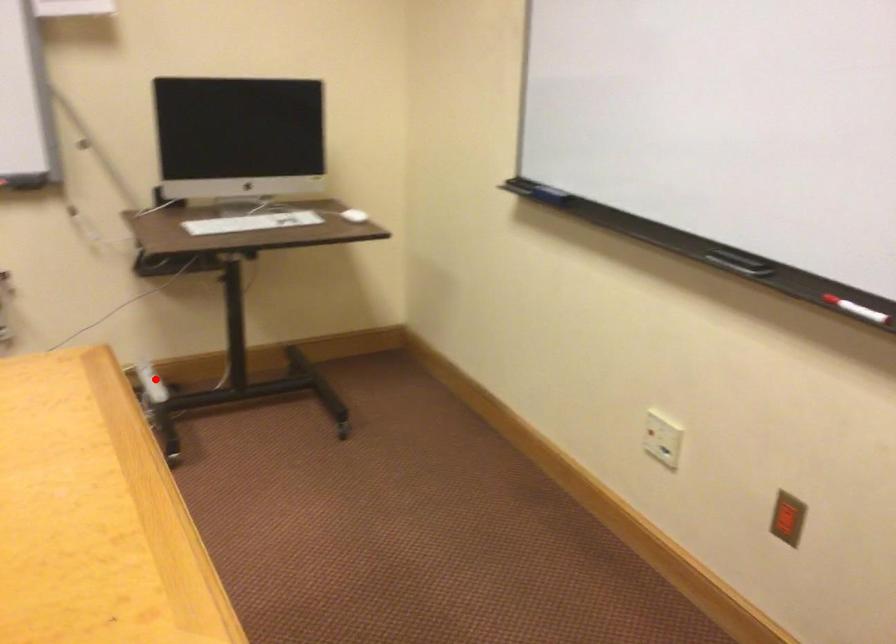
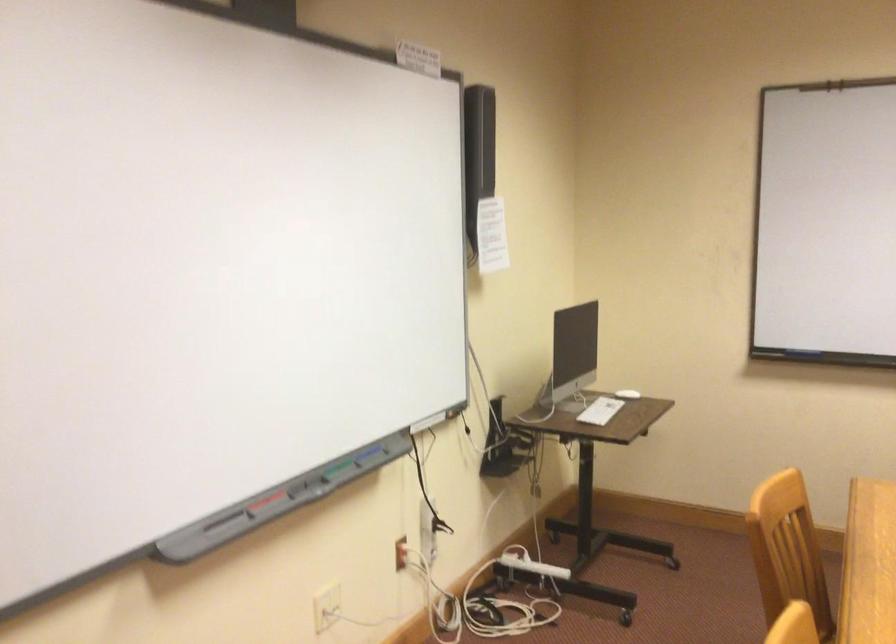
Question: A red point is marked in image1. In image2, is the corresponding 3D point closer to the camera or farther? Reply with the corresponding letter.

Choices:
 (A) The corresponding 3D point is closer.
 (B) The corresponding 3D point is farther.

Answer: (B)